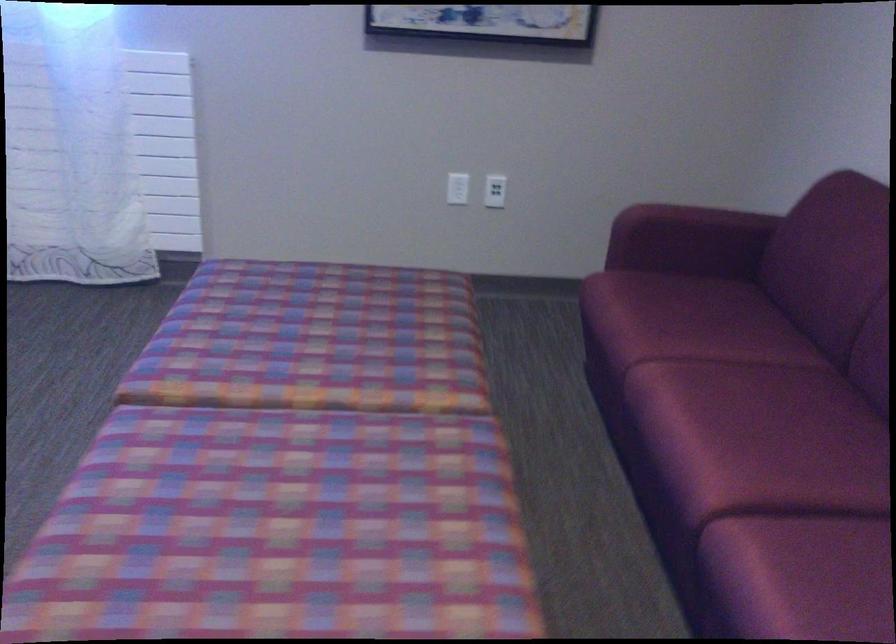
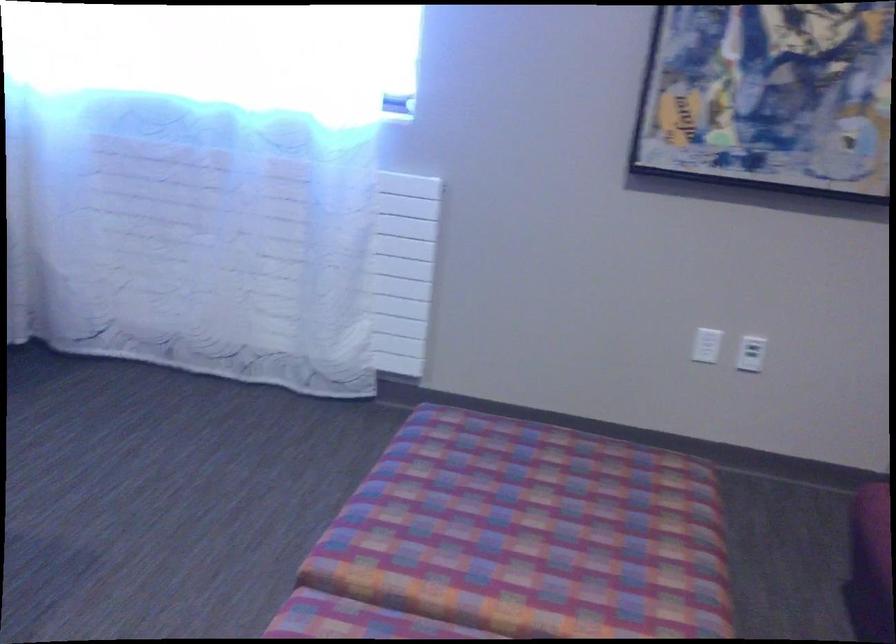
Find the pixel in the second image that matches point 328,327 in the first image.

(550, 516)